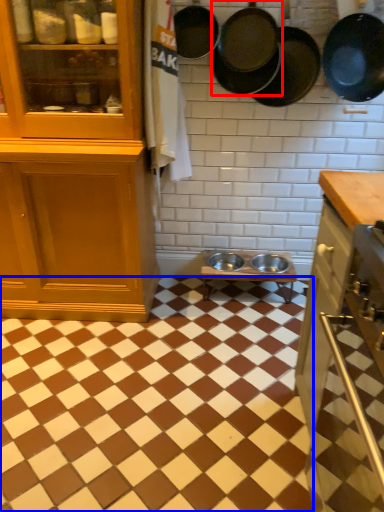
Question: Which object is further to the camera taking this photo, frying pan (highlighted by a red box) or square (highlighted by a blue box)?

Choices:
 (A) frying pan
 (B) square

Answer: (A)